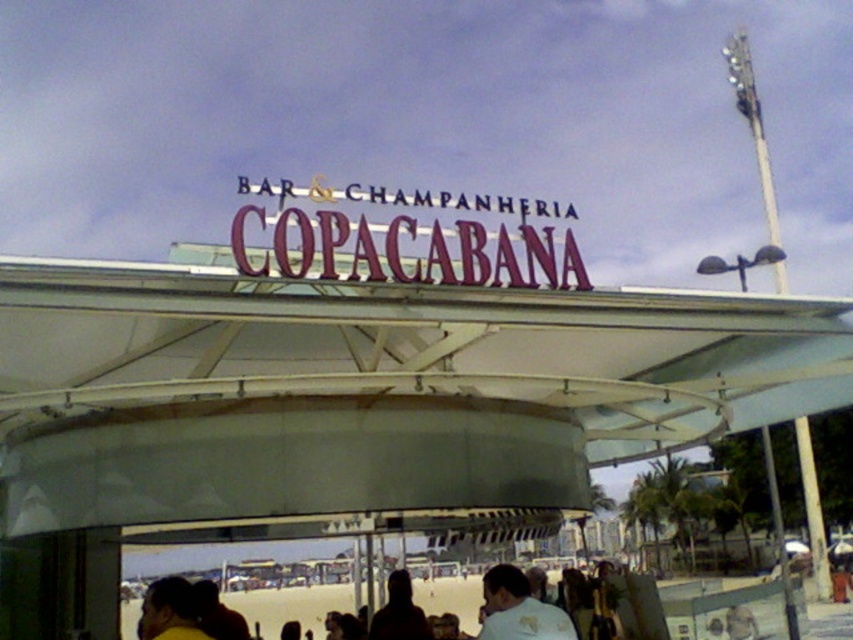
Consider the image. Who is more distant from viewer, (161,582) or (375,630)?

The point (375,630) is behind.

Image resolution: width=853 pixels, height=640 pixels. Find the location of `yellow fabric hair at lower left`. yellow fabric hair at lower left is located at coordinates (170, 611).

At what (x,y) coordinates should I click in order to perform the action: click on yellow fabric hair at lower left. Please return your answer as a coordinate pair (x, y). Image resolution: width=853 pixels, height=640 pixels. Looking at the image, I should click on (170, 611).

In the scene shown: Does white cotton shirt at lower center have a greater width compared to silky black hair at center?

Correct, the width of white cotton shirt at lower center exceeds that of silky black hair at center.

Is white cotton shirt at lower center behind silky black hair at center?

No, white cotton shirt at lower center is closer to the viewer.

Describe the element at coordinates (518, 609) in the screenshot. I see `white cotton shirt at lower center` at that location.

In order to click on white cotton shirt at lower center in this screenshot , I will do `click(518, 609)`.

Is white matte canopy at center to the right of white cotton shirt at lower center from the viewer's perspective?

No, white matte canopy at center is not to the right of white cotton shirt at lower center.

Can you confirm if white matte canopy at center is positioned below white cotton shirt at lower center?

No.

Which is in front, point (177, 291) or point (488, 595)?

Point (177, 291)

Locate an element on the screen. This screenshot has height=640, width=853. white matte canopy at center is located at coordinates (368, 390).